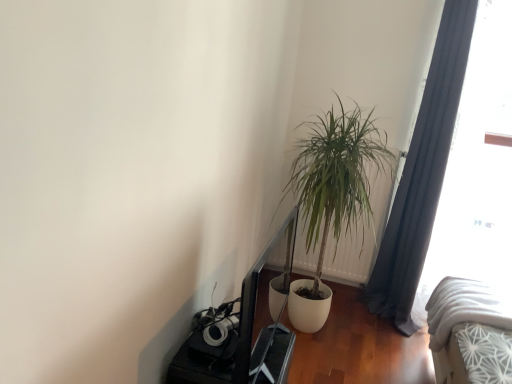
Question: Is transparent glass window at right taller or shorter than white plastic radiator at center-right?

Choices:
 (A) tall
 (B) short

Answer: (A)

Question: From a real-world perspective, is transparent glass window at right above or below white plastic radiator at center-right?

Choices:
 (A) above
 (B) below

Answer: (A)

Question: Which object is the closest to the dark gray fabric curtain at right?

Choices:
 (A) green leafy plant at center
 (B) white plastic radiator at center-right
 (C) white textured bed at lower right
 (D) transparent glass window at right

Answer: (B)

Question: Considering the real-world distances, which object is closest to the dark gray fabric curtain at right?

Choices:
 (A) white plastic radiator at center-right
 (B) transparent glass window at right
 (C) green leafy plant at center
 (D) white textured bed at lower right

Answer: (A)